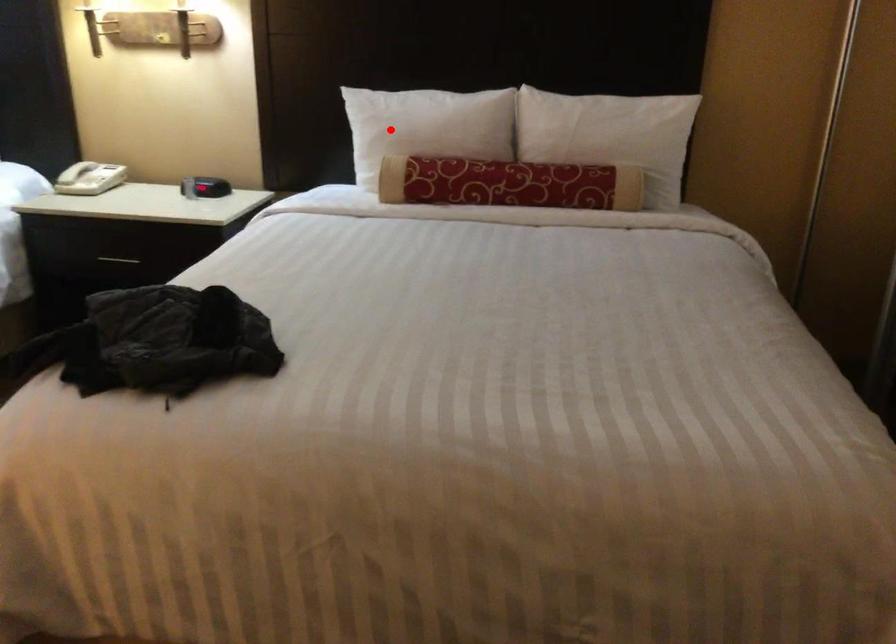
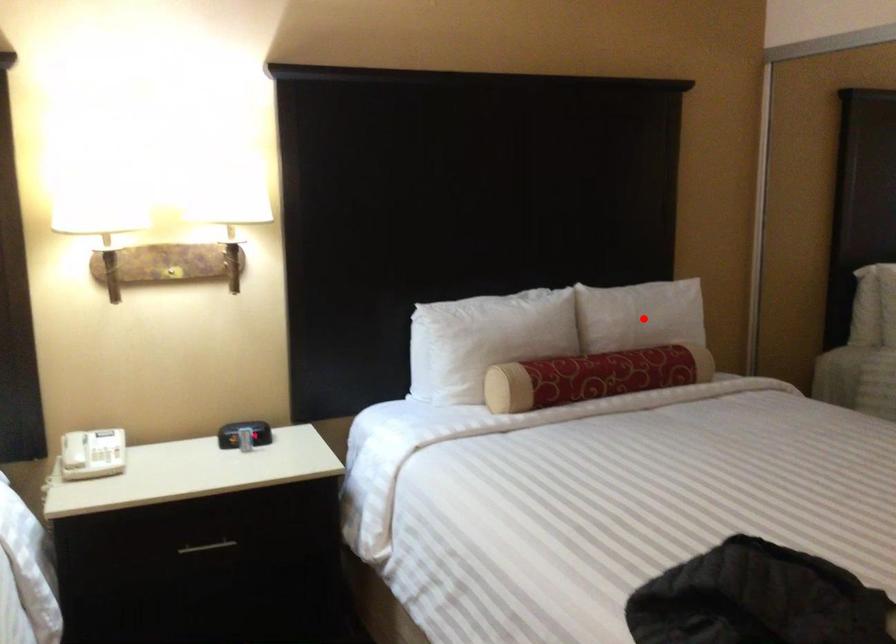
I am providing you with two images of the same scene from different viewpoints. A red point is marked on the first image and another point is marked on the second image. Does the point marked in image1 correspond to the same location as the one in image2?

No